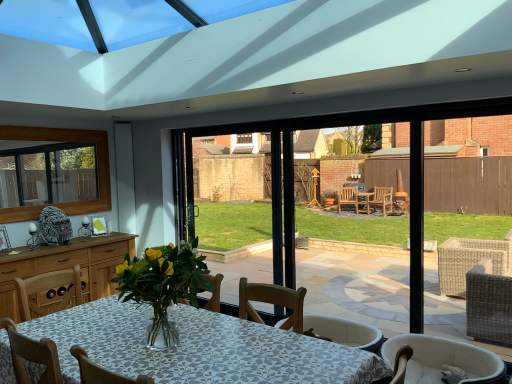
Question: Looking at their shapes, would you say wooden frame at upper left is wider or thinner than white fabric chair at lower right?

Choices:
 (A) wide
 (B) thin

Answer: (B)

Question: In terms of height, does wooden frame at upper left look taller or shorter compared to white fabric chair at lower right?

Choices:
 (A) tall
 (B) short

Answer: (A)

Question: Is wooden frame at upper left bigger or smaller than white fabric chair at lower right?

Choices:
 (A) small
 (B) big

Answer: (A)

Question: Is white fabric chair at lower right to the left or to the right of wooden frame at upper left in the image?

Choices:
 (A) right
 (B) left

Answer: (A)

Question: In terms of width, does white fabric chair at lower right look wider or thinner when compared to wooden frame at upper left?

Choices:
 (A) thin
 (B) wide

Answer: (B)

Question: From a real-world perspective, is white fabric chair at lower right positioned above or below wooden frame at upper left?

Choices:
 (A) below
 (B) above

Answer: (A)

Question: Is point (501, 375) closer or farther from the camera than point (96, 158)?

Choices:
 (A) closer
 (B) farther

Answer: (A)